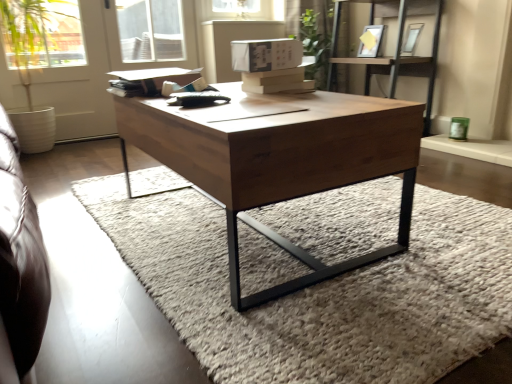
Question: Visually, is green leafy plant at upper center positioned to the left or to the right of matte white picture frame at upper center, arranged as the second picture frame when viewed from the right?

Choices:
 (A) left
 (B) right

Answer: (A)

Question: From a real-world perspective, is green leafy plant at upper center positioned above or below matte white picture frame at upper center, positioned as the 1th picture frame in left-to-right order?

Choices:
 (A) below
 (B) above

Answer: (A)

Question: Which object is the closest to the wooden coffee table at center?

Choices:
 (A) soft wool rug at center
 (B) matte white picture frame at upper center, positioned as the 1th picture frame in left-to-right order
 (C) white matte screen door at upper left
 (D) green leafy plant at upper center
 (E) wooden shelf at upper right

Answer: (A)

Question: Estimate the real-world distances between objects in this image. Which object is farther from the wooden coffee table at center?

Choices:
 (A) soft wool rug at center
 (B) matte white picture frame at upper center, arranged as the second picture frame when viewed from the right
 (C) white matte screen door at upper left
 (D) transparent glass window at upper center
 (E) wooden shelf at upper right

Answer: (D)